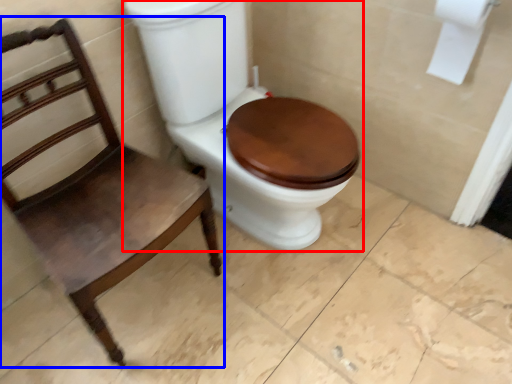
Question: Which of the following is the farthest to the observer, toilet (highlighted by a red box) or chair (highlighted by a blue box)?

Choices:
 (A) toilet
 (B) chair

Answer: (A)